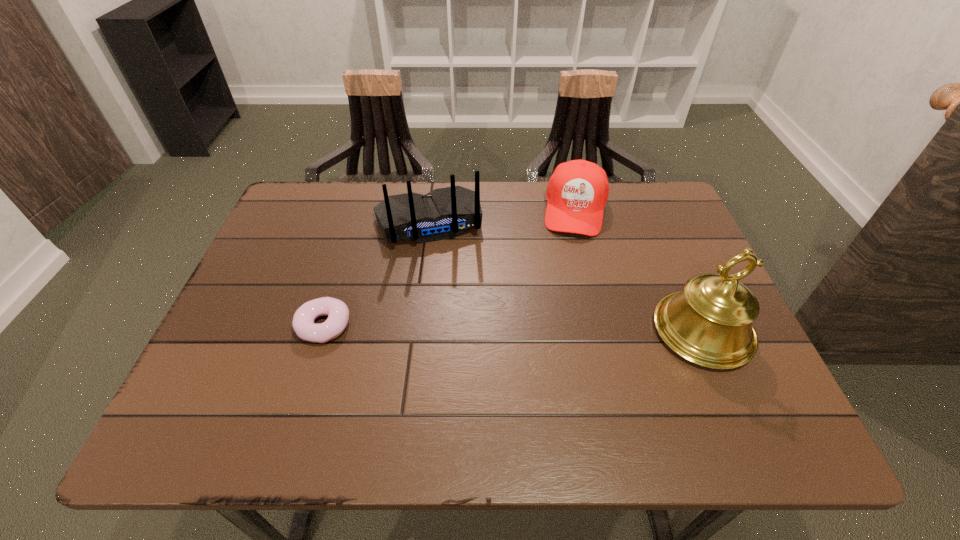
Where is `free point located 0.120m on the back of the router`? free point located 0.120m on the back of the router is located at coordinates (448, 284).

I want to click on vacant space located 0.400m on the front panel of the third object from left to right, so click(559, 362).

Where is `vacant region located 0.270m on the front panel of the third object from left to right`? vacant region located 0.270m on the front panel of the third object from left to right is located at coordinates (564, 315).

Identify the location of vacant space situated on the front panel of the third object from left to right. This screenshot has height=540, width=960. 564,325.

The image size is (960, 540). Identify the location of router positioned at the far edge. (443, 213).

Identify the location of baseball cap that is at the far edge. The width and height of the screenshot is (960, 540). (577, 192).

This screenshot has width=960, height=540. I want to click on object that is at the near edge, so click(x=709, y=323).

This screenshot has width=960, height=540. I want to click on object that is at the left edge, so coord(338,313).

Image resolution: width=960 pixels, height=540 pixels. In order to click on object present at the right edge in this screenshot , I will do `click(709, 323)`.

The width and height of the screenshot is (960, 540). Identify the location of object situated at the near right corner. (709, 323).